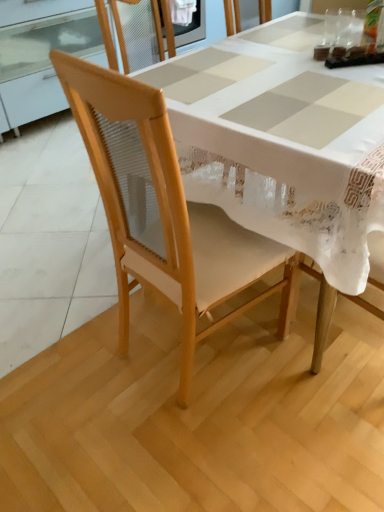
Where is `vacant area on the back side of transparent plastic cup at upper right, placed as the first tableware when sorted from left to right`? The image size is (384, 512). vacant area on the back side of transparent plastic cup at upper right, placed as the first tableware when sorted from left to right is located at coordinates (338, 29).